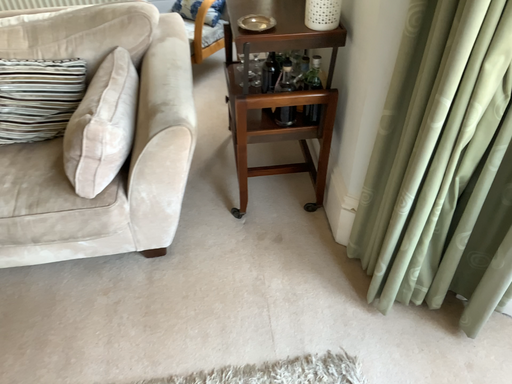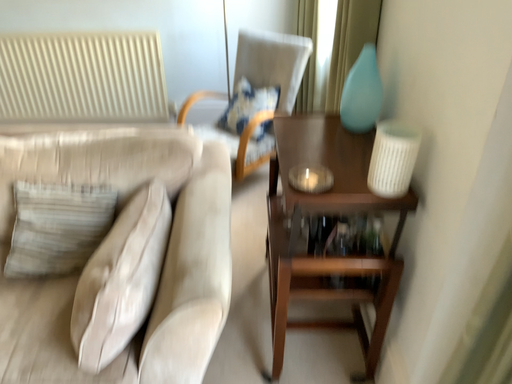
Question: Which way did the camera rotate in the video?

Choices:
 (A) rotated downward
 (B) rotated upward

Answer: (B)